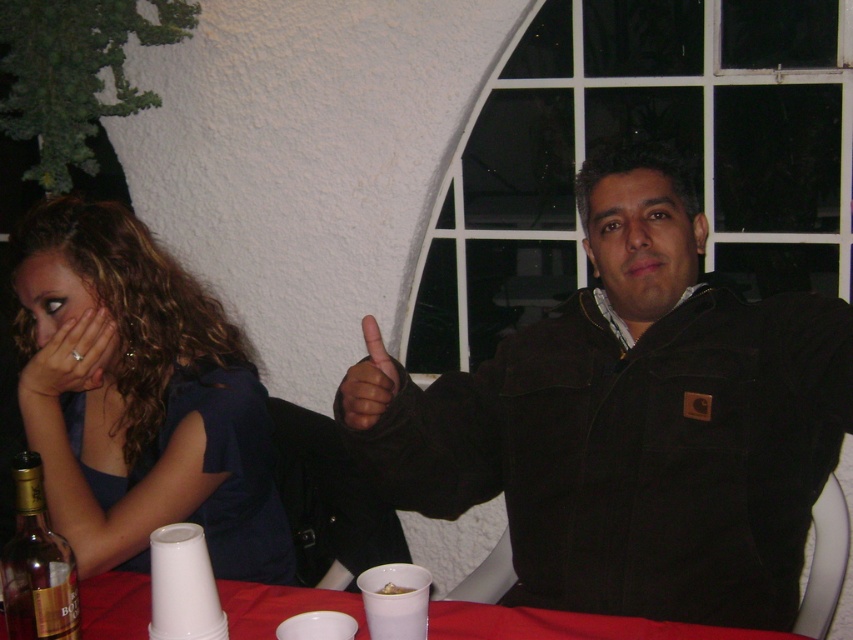
Question: Which point is closer to the camera?

Choices:
 (A) (438, 621)
 (B) (71, 333)

Answer: (A)

Question: Considering the real-world distances, which object is farthest from the smooth plastic cups at lower center?

Choices:
 (A) gold foil bottle at lower left
 (B) matte black hand at lower left
 (C) black corduroy jacket at center

Answer: (B)

Question: Which of the following is the closest to the observer?

Choices:
 (A) click(x=677, y=589)
 (B) click(x=44, y=625)
 (C) click(x=665, y=624)

Answer: (B)

Question: Is smooth plastic cups at lower center positioned in front of gold foil bottle at lower left?

Choices:
 (A) yes
 (B) no

Answer: (B)

Question: Does matte blue dress at left appear under smooth plastic cups at lower center?

Choices:
 (A) yes
 (B) no

Answer: (B)

Question: Can you confirm if gold foil bottle at lower left is smaller than matte black hand at lower left?

Choices:
 (A) no
 (B) yes

Answer: (A)